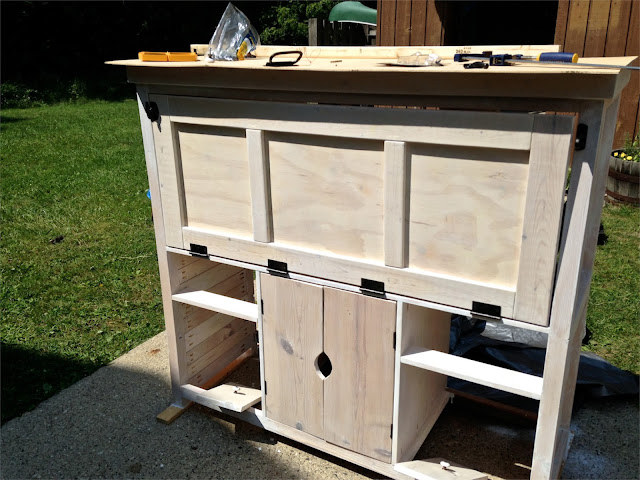
I want to click on shelves, so click(241, 305), click(461, 368).